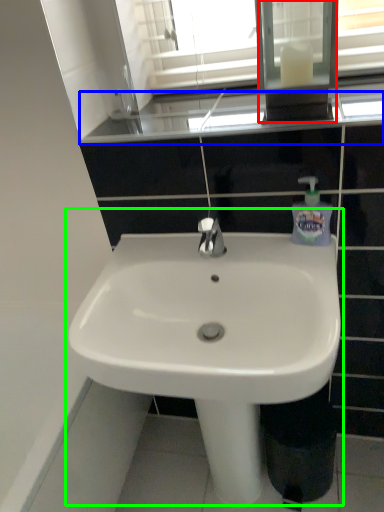
Question: Which is nearer to the medicine cabinet (highlighted by a red box)? window sill (highlighted by a blue box) or sink (highlighted by a green box).

Choices:
 (A) window sill
 (B) sink

Answer: (A)